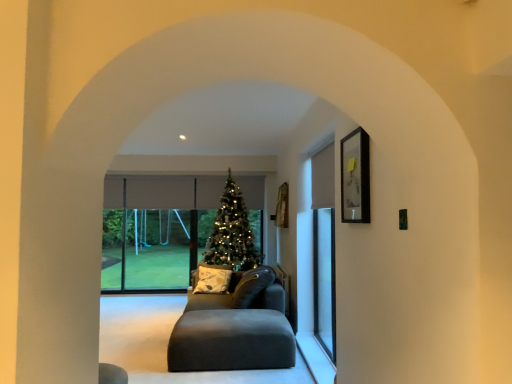
Question: Is matte black picture frame at upper right oriented towards yellow-green printed cushion at center?

Choices:
 (A) no
 (B) yes

Answer: (A)

Question: Can you see matte black picture frame at upper right touching yellow-green printed cushion at center?

Choices:
 (A) no
 (B) yes

Answer: (A)

Question: Considering the relative sizes of matte black picture frame at upper right and yellow-green printed cushion at center in the image provided, is matte black picture frame at upper right shorter than yellow-green printed cushion at center?

Choices:
 (A) yes
 (B) no

Answer: (A)

Question: From the image's perspective, is matte black picture frame at upper right located beneath yellow-green printed cushion at center?

Choices:
 (A) no
 (B) yes

Answer: (A)

Question: Can you confirm if matte black picture frame at upper right is smaller than yellow-green printed cushion at center?

Choices:
 (A) no
 (B) yes

Answer: (B)

Question: From the image's perspective, is clear glass screen door at right above or below matte black ottoman at center?

Choices:
 (A) above
 (B) below

Answer: (A)

Question: Looking at the image, does clear glass screen door at right seem bigger or smaller compared to matte black ottoman at center?

Choices:
 (A) big
 (B) small

Answer: (B)

Question: Considering the positions of clear glass screen door at right and matte black ottoman at center in the image, is clear glass screen door at right taller or shorter than matte black ottoman at center?

Choices:
 (A) short
 (B) tall

Answer: (B)

Question: From a real-world perspective, is clear glass screen door at right physically located above or below matte black ottoman at center?

Choices:
 (A) below
 (B) above

Answer: (B)

Question: Is matte black picture frame at upper right to the left or to the right of yellow-green printed cushion at center in the image?

Choices:
 (A) left
 (B) right

Answer: (B)

Question: In the image, is matte black picture frame at upper right positioned in front of or behind yellow-green printed cushion at center?

Choices:
 (A) behind
 (B) front

Answer: (B)

Question: From a real-world perspective, is matte black picture frame at upper right above or below yellow-green printed cushion at center?

Choices:
 (A) above
 (B) below

Answer: (A)

Question: Is matte black picture frame at upper right inside the boundaries of yellow-green printed cushion at center, or outside?

Choices:
 (A) outside
 (B) inside

Answer: (A)

Question: From a real-world perspective, relative to matte gray couch at center, is matte black picture frame at upper right vertically above or below?

Choices:
 (A) above
 (B) below

Answer: (A)

Question: Is matte black picture frame at upper right to the left or to the right of matte gray couch at center in the image?

Choices:
 (A) right
 (B) left

Answer: (A)